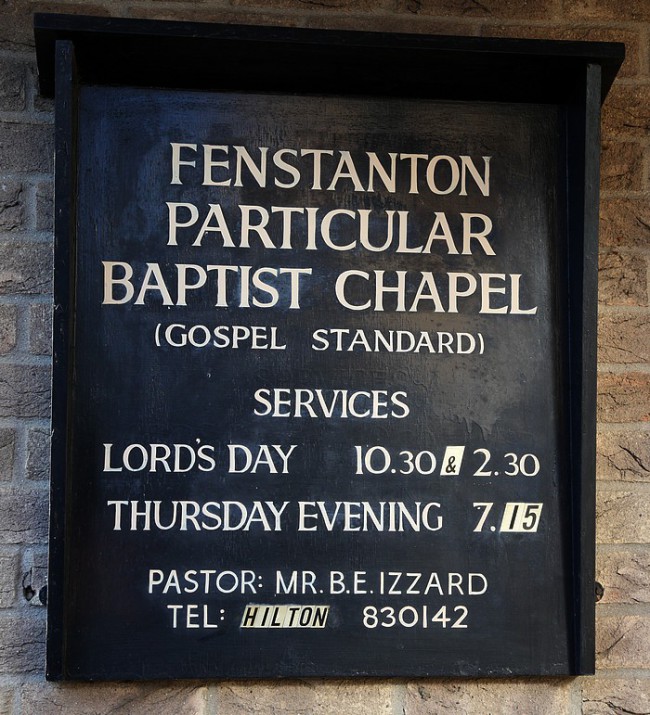
Image resolution: width=650 pixels, height=715 pixels. Identify the location of brick wall. (32, 390).